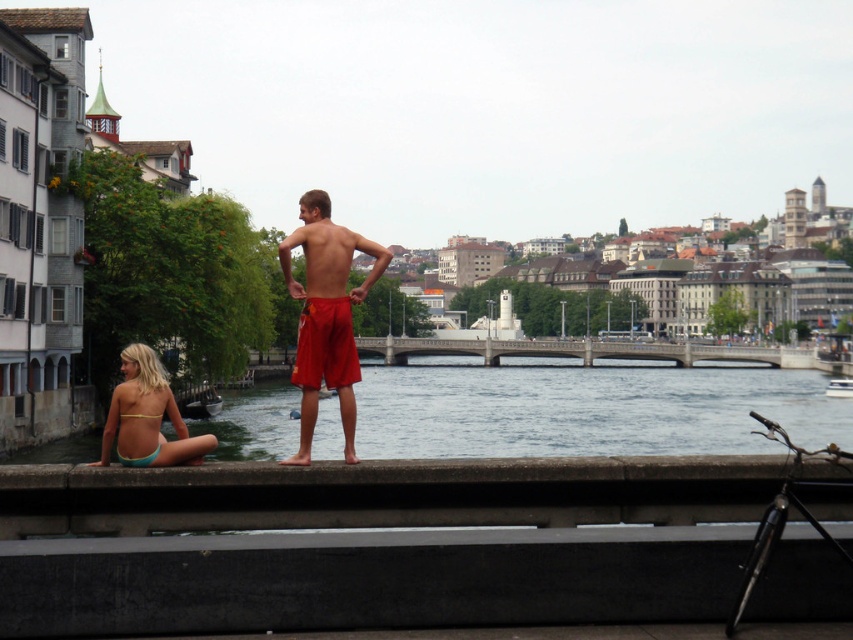
Is matte red shorts at center to the left of light blue bikini at lower left from the viewer's perspective?

In fact, matte red shorts at center is to the right of light blue bikini at lower left.

Between point (318, 381) and point (172, 454), which one is positioned in front?

Point (172, 454) is in front.

This screenshot has width=853, height=640. What do you see at coordinates (326, 314) in the screenshot?
I see `matte red shorts at center` at bounding box center [326, 314].

Where is `matte red shorts at center`? The image size is (853, 640). matte red shorts at center is located at coordinates (326, 314).